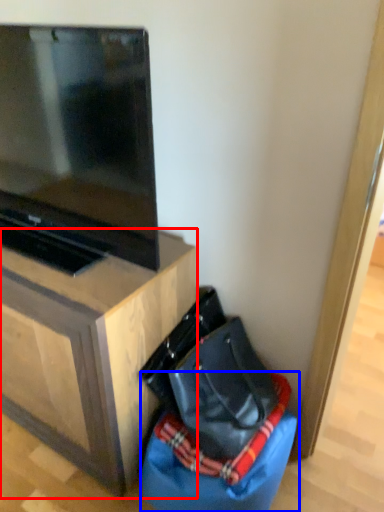
Question: Which object appears closest to the camera in this image, furniture (highlighted by a red box) or bean bag chair (highlighted by a blue box)?

Choices:
 (A) furniture
 (B) bean bag chair

Answer: (A)